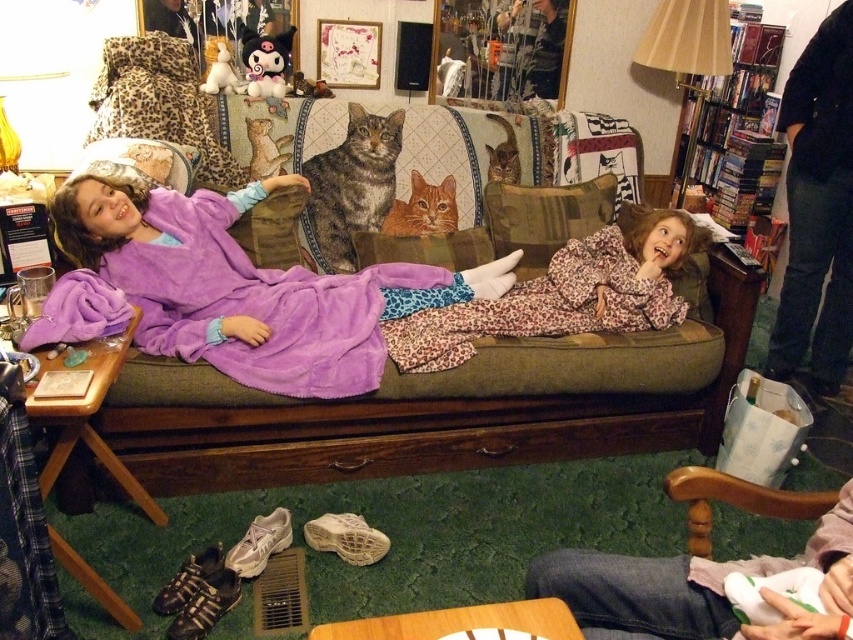
How far apart are leopard print blanket at center and leopard print pillow at center?

leopard print blanket at center is 33.98 centimeters away from leopard print pillow at center.

Locate an element on the screen. This screenshot has height=640, width=853. leopard print blanket at center is located at coordinates (566, 292).

Is velvet green couch at center to the left of white fabric at lower right from the viewer's perspective?

Indeed, velvet green couch at center is positioned on the left side of white fabric at lower right.

Is velvet green couch at center taller than white fabric at lower right?

Correct, velvet green couch at center is much taller as white fabric at lower right.

Is point (108, 417) closer to viewer compared to point (714, 595)?

No.

Find the location of a particular element. This screenshot has height=640, width=853. velvet green couch at center is located at coordinates (445, 404).

Is velvet green couch at center closer to the viewer compared to leopard print pillow at center?

Yes, velvet green couch at center is closer to the viewer.

Is point (749, 292) farther from camera compared to point (460, 268)?

No, (749, 292) is closer to viewer.

The image size is (853, 640). In order to click on velvet green couch at center in this screenshot , I will do `click(445, 404)`.